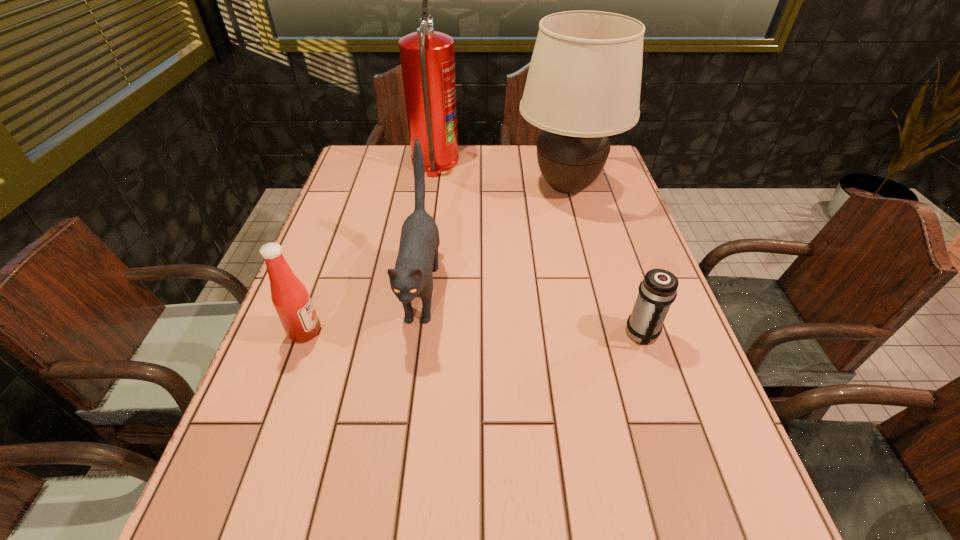
You are a GUI agent. You are given a task and a screenshot of the screen. Output one action in this format:
    pyautogui.click(x=<x>, y=<y>)
    Task: Click on the free space at the right edge of the desktop
    This screenshot has height=540, width=960.
    Given the screenshot: What is the action you would take?
    pyautogui.click(x=673, y=491)

Where is `free space at the far left corner`? free space at the far left corner is located at coordinates (395, 177).

Identify the location of vacant region at the far right corner of the desktop. (608, 161).

At what (x,y) coordinates should I click in order to perform the action: click on free spot between the thermos bottle and the third tallest object. Please return your answer as a coordinate pair (x, y). This screenshot has height=540, width=960. Looking at the image, I should click on (532, 313).

This screenshot has width=960, height=540. In order to click on vacant area that lies between the condiment and the cat in this screenshot , I will do `click(363, 311)`.

Locate an element on the screen. Image resolution: width=960 pixels, height=540 pixels. free area in between the cat and the lampshade is located at coordinates (494, 239).

The width and height of the screenshot is (960, 540). Identify the location of vacant point located between the leftmost object and the fire extinguisher. (370, 247).

The width and height of the screenshot is (960, 540). What are the coordinates of `free space between the fire extinguisher and the condiment` in the screenshot? It's located at (370, 247).

Identify the location of free space between the cat and the leftmost object. (363, 311).

The image size is (960, 540). Find the location of `free spot between the thermos bottle and the lampshade`. free spot between the thermos bottle and the lampshade is located at coordinates (605, 261).